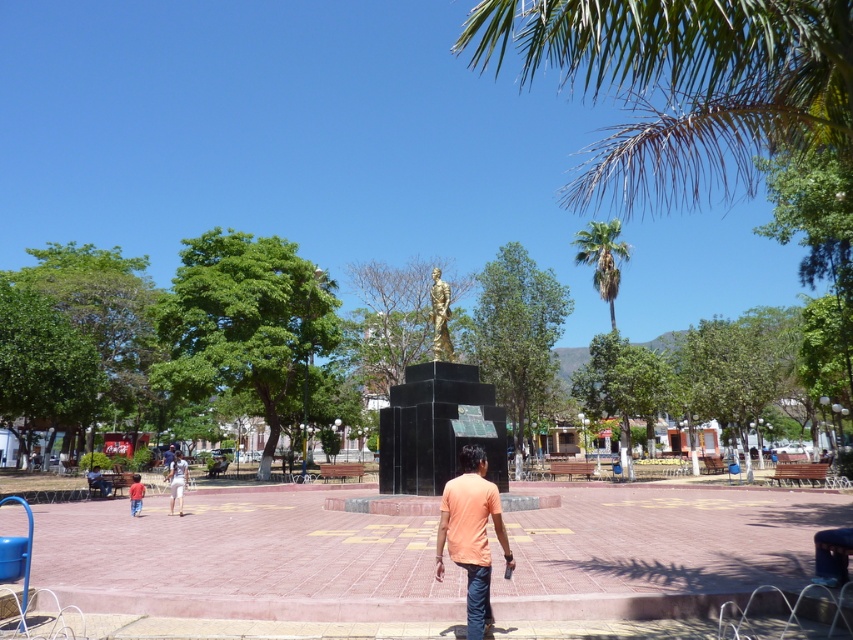
Question: Can you confirm if orange cotton shirt at center is positioned below white cotton shorts at center?

Choices:
 (A) no
 (B) yes

Answer: (A)

Question: Which point is farther to the camera?

Choices:
 (A) (616, 276)
 (B) (496, 525)
 (C) (445, 349)
 (D) (129, 497)

Answer: (A)

Question: Does white cotton shorts at center appear over red cotton shirt at lower left?

Choices:
 (A) no
 (B) yes

Answer: (A)

Question: Is green leafy palm tree at upper center below red cotton shirt at lower left?

Choices:
 (A) yes
 (B) no

Answer: (B)

Question: Which object is farther from the camera taking this photo?

Choices:
 (A) green leafy palm tree at upper center
 (B) red cotton shirt at lower left
 (C) gold polished statue at center

Answer: (A)

Question: Which point is closer to the camera?

Choices:
 (A) (129, 496)
 (B) (482, 552)
 (C) (436, 280)
 (D) (183, 493)

Answer: (B)